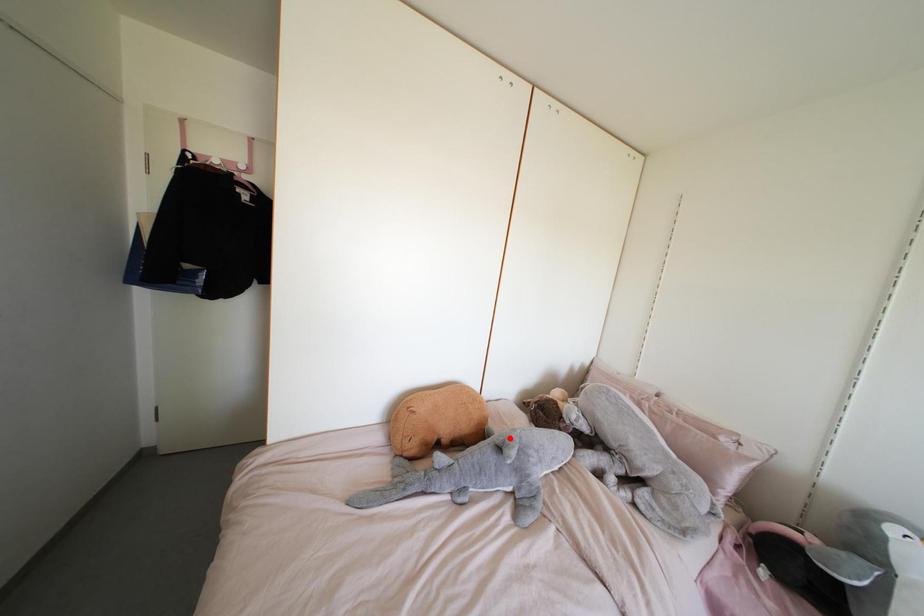
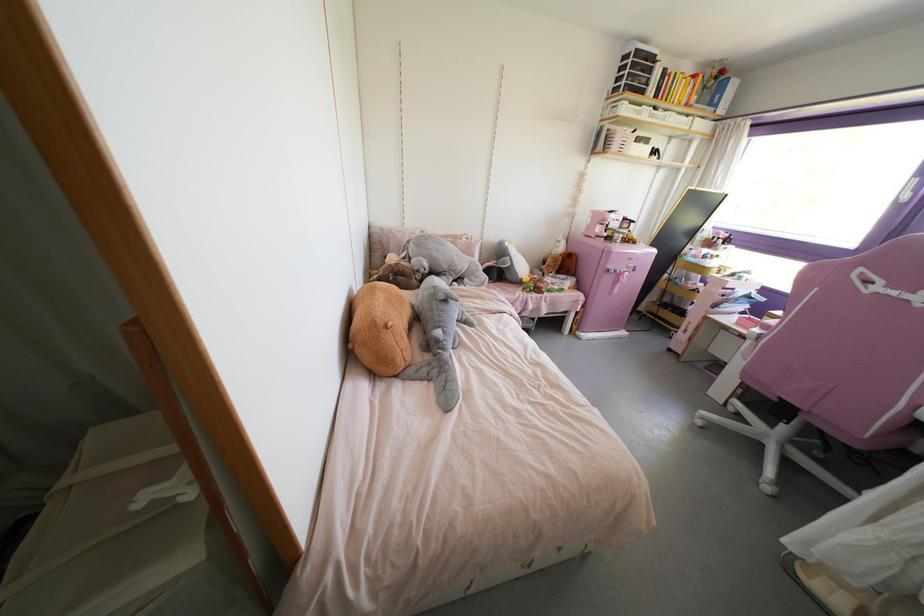
In the second image, find the point that corresponds to the highlighted location in the first image.

(444, 290)